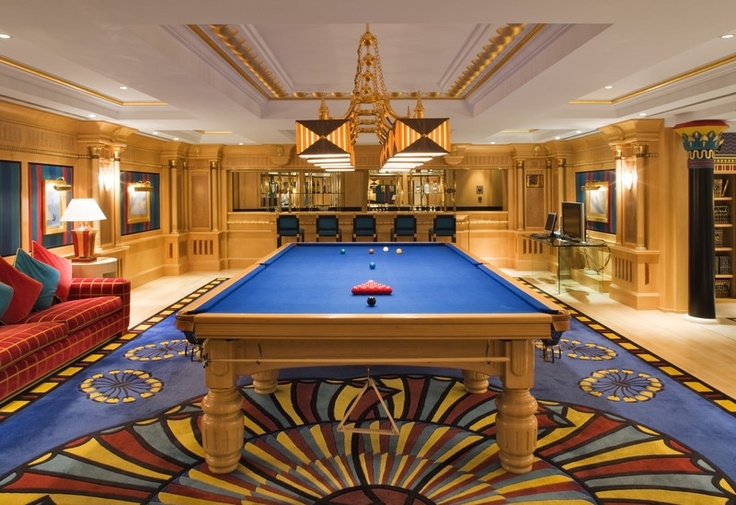
I want to click on carpet pattern, so click(x=124, y=383), click(x=163, y=347), click(x=567, y=346), click(x=631, y=386), click(x=369, y=483), click(x=130, y=334), click(x=629, y=337).